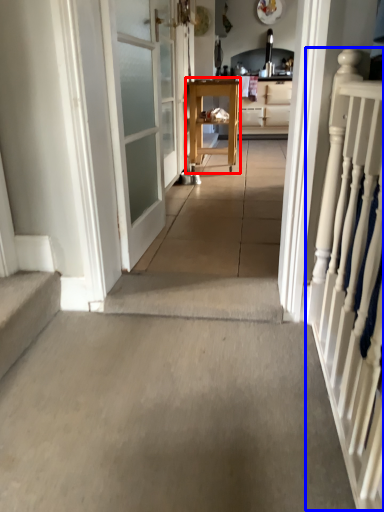
Question: Among these objects, which one is farthest to the camera, furniture (highlighted by a red box) or rail (highlighted by a blue box)?

Choices:
 (A) furniture
 (B) rail

Answer: (A)